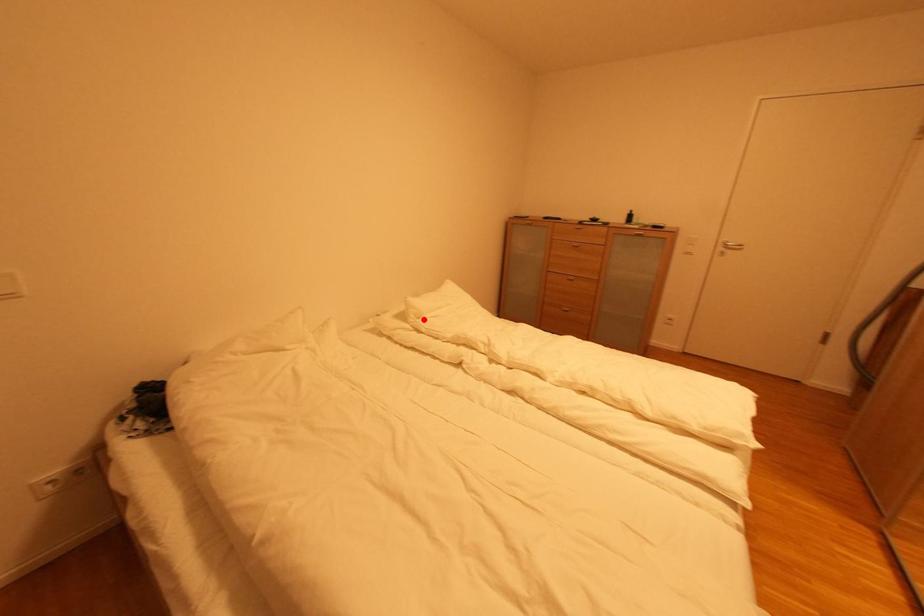
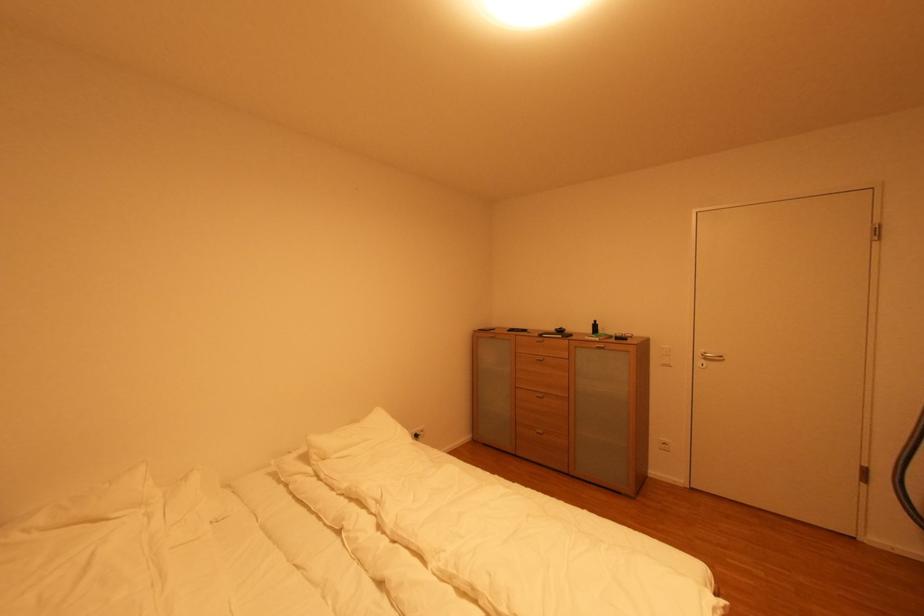
In the second image, find the point that corresponds to the highlighted location in the first image.

(330, 461)